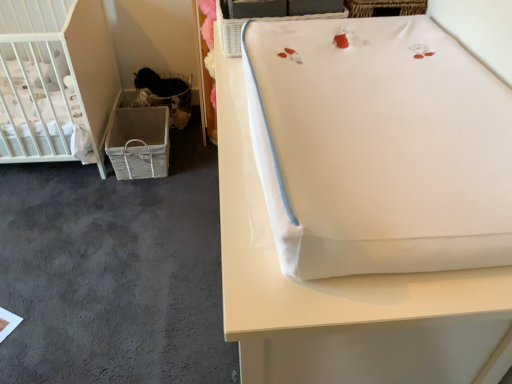
Measure the distance between woven fabric basket at lower left and camera.

woven fabric basket at lower left and camera are 7.19 feet apart from each other.

What do you see at coordinates (113, 275) in the screenshot? This screenshot has height=384, width=512. I see `gray carpet at lower left` at bounding box center [113, 275].

The height and width of the screenshot is (384, 512). What do you see at coordinates (343, 295) in the screenshot?
I see `white fabric changing pad at upper right` at bounding box center [343, 295].

Find the location of a particular element. The image size is (512, 384). white matte crib at left is located at coordinates (55, 80).

Consider the image. Is gray carpet at lower left wider or thinner than white wicker basket at upper center, arranged as the second basket when viewed from the left?

Considering their sizes, gray carpet at lower left looks broader than white wicker basket at upper center, arranged as the second basket when viewed from the left.

Based on their sizes in the image, would you say gray carpet at lower left is bigger or smaller than white wicker basket at upper center, the first basket positioned from the front?

Considering their sizes, gray carpet at lower left takes up more space than white wicker basket at upper center, the first basket positioned from the front.

Would you say gray carpet at lower left is to the left or to the right of white wicker basket at upper center, the first basket positioned from the front, in the picture?

gray carpet at lower left is positioned on white wicker basket at upper center, the first basket positioned from the front,'s left side.

Is gray carpet at lower left taller or shorter than white wicker basket at upper center, arranged as the second basket when viewed from the left?

In the image, gray carpet at lower left appears to be shorter than white wicker basket at upper center, arranged as the second basket when viewed from the left.

How far apart are white wicker basket at upper center, marked as the 2th basket in a back-to-front arrangement, and white fabric changing pad at upper right?

white wicker basket at upper center, marked as the 2th basket in a back-to-front arrangement, is 49.37 centimeters away from white fabric changing pad at upper right.

Which is closer, (339,14) or (227,318)?

Point (227,318)

The image size is (512, 384). What are the coordinates of `the 1st basket to the left of the white fabric changing pad at upper right, counting from the anchor's position` in the screenshot? It's located at (229, 33).

Are white wicker basket at upper center, marked as the 2th basket in a back-to-front arrangement, and white fabric changing pad at upper right located far from each other?

white wicker basket at upper center, marked as the 2th basket in a back-to-front arrangement, is near white fabric changing pad at upper right, not far away.

Which object is closer to the camera, white fabric changing pad at upper right or woven fabric basket at lower left, the 1th basket from the back?

Positioned in front is white fabric changing pad at upper right.

Based on the photo, does white fabric changing pad at upper right appear on the left side of woven fabric basket at lower left, arranged as the 1th basket when viewed from the left?

No.

Looking at this image, from the image's perspective, is white fabric changing pad at upper right above or below woven fabric basket at lower left, the 2th basket viewed from the right?

From the image's perspective, white fabric changing pad at upper right appears below woven fabric basket at lower left, the 2th basket viewed from the right.

I want to click on furniture lying in front of the woven fabric basket at lower left, the 2th basket in the front-to-back sequence, so click(x=343, y=295).

Which of these two, woven fabric basket at lower left, the 2th basket in the front-to-back sequence, or white wicker basket at upper center, arranged as the second basket when viewed from the left, is bigger?

woven fabric basket at lower left, the 2th basket in the front-to-back sequence.

Is woven fabric basket at lower left, arranged as the 1th basket when viewed from the left, positioned with its back to white wicker basket at upper center, the first basket positioned from the front?

No, white wicker basket at upper center, the first basket positioned from the front, is not at the back of woven fabric basket at lower left, arranged as the 1th basket when viewed from the left.

From the image's perspective, between woven fabric basket at lower left, arranged as the 1th basket when viewed from the left, and white wicker basket at upper center, arranged as the second basket when viewed from the left, who is located below?

white wicker basket at upper center, arranged as the second basket when viewed from the left, appears lower in the image.

Does point (183, 98) lie behind point (120, 115)?

Yes, point (183, 98) is behind point (120, 115).

From a real-world perspective, which basket is the 1st one above the woven fabric basket at lower left? Please provide its 2D coordinates.

[(164, 95)]

Which is more to the right, woven fabric basket at lower left, arranged as the 1th basket when viewed from the left, or woven fabric basket at lower left?

woven fabric basket at lower left, arranged as the 1th basket when viewed from the left, is more to the right.

Consider the image. Looking at their sizes, would you say woven fabric basket at lower left, the 2th basket in the front-to-back sequence, is wider or thinner than woven fabric basket at lower left?

Considering their sizes, woven fabric basket at lower left, the 2th basket in the front-to-back sequence, looks slimmer than woven fabric basket at lower left.

Is woven fabric basket at lower left oriented away from woven fabric basket at lower left, the 2th basket in the front-to-back sequence?

Yes, woven fabric basket at lower left's orientation is away from woven fabric basket at lower left, the 2th basket in the front-to-back sequence.

Which is less distant, (117, 142) or (179, 89)?

The point (117, 142) is closer.

There is a woven fabric basket at lower left. Identify the location of the 2nd basket above it (from the image's perspective). Image resolution: width=512 pixels, height=384 pixels. (164, 95).

Between woven fabric basket at lower left and woven fabric basket at lower left, the 2th basket in the front-to-back sequence, which one has less height?

woven fabric basket at lower left.

Consider the image. Who is shorter, woven fabric basket at lower left, the 2th basket viewed from the right, or white matte crib at left?

woven fabric basket at lower left, the 2th basket viewed from the right, is shorter.

In the scene shown: Is woven fabric basket at lower left, arranged as the 1th basket when viewed from the left, oriented towards white matte crib at left?

No, woven fabric basket at lower left, arranged as the 1th basket when viewed from the left, is not aimed at white matte crib at left.

Who is bigger, woven fabric basket at lower left, the 1th basket from the back, or white matte crib at left?

Bigger between the two is white matte crib at left.

Identify the location of concrete located behind the white wicker basket at upper center, the first basket positioned from the front. (113, 275).

At what (x,y) coordinates should I click in order to perform the action: click on furniture below the white wicker basket at upper center, the first basket viewed from the right (from the image's perspective). Please return your answer as a coordinate pair (x, y). Looking at the image, I should click on (343, 295).

Which object lies further to the anchor point woven fabric basket at lower left, the 2th basket in the front-to-back sequence, white wicker basket at upper center, the first basket viewed from the right, or white matte crib at left?

The object further to woven fabric basket at lower left, the 2th basket in the front-to-back sequence, is white wicker basket at upper center, the first basket viewed from the right.

Which object lies nearer to the anchor point gray carpet at lower left, woven fabric basket at lower left, arranged as the 1th basket when viewed from the left, or woven fabric basket at lower left?

The object closer to gray carpet at lower left is woven fabric basket at lower left.

Which object lies nearer to the anchor point white matte crib at left, white fabric changing pad at upper right or woven fabric basket at lower left, the 2th basket viewed from the right?

woven fabric basket at lower left, the 2th basket viewed from the right, is closer to white matte crib at left.

Estimate the real-world distances between objects in this image. Which object is further from white matte crib at left, gray carpet at lower left or white wicker basket at upper center, marked as the 2th basket in a back-to-front arrangement?

white wicker basket at upper center, marked as the 2th basket in a back-to-front arrangement.

Based on their spatial positions, is woven fabric basket at lower left or white matte crib at left further from white wicker basket at upper center, the first basket viewed from the right?

The object further to white wicker basket at upper center, the first basket viewed from the right, is woven fabric basket at lower left.

When comparing their distances from white fabric changing pad at upper right, does white wicker basket at upper center, arranged as the second basket when viewed from the left, or woven fabric basket at lower left, arranged as the 1th basket when viewed from the left, seem closer?

Based on the image, white wicker basket at upper center, arranged as the second basket when viewed from the left, appears to be nearer to white fabric changing pad at upper right.

Based on their spatial positions, is white matte crib at left or white fabric changing pad at upper right further from woven fabric basket at lower left, the 2th basket viewed from the right?

Based on the image, white fabric changing pad at upper right appears to be further to woven fabric basket at lower left, the 2th basket viewed from the right.

When comparing their distances from white wicker basket at upper center, the first basket positioned from the front, does woven fabric basket at lower left, the 2th basket viewed from the right, or white fabric changing pad at upper right seem further?

woven fabric basket at lower left, the 2th basket viewed from the right, is positioned further to the anchor white wicker basket at upper center, the first basket positioned from the front.

Where is `crate between gray carpet at lower left and woven fabric basket at lower left, arranged as the 1th basket when viewed from the left, along the z-axis`? The image size is (512, 384). crate between gray carpet at lower left and woven fabric basket at lower left, arranged as the 1th basket when viewed from the left, along the z-axis is located at coordinates (139, 142).

The width and height of the screenshot is (512, 384). Identify the location of crate situated between white matte crib at left and white wicker basket at upper center, the first basket positioned from the front, from left to right. (139, 142).

Locate an element on the screen. The height and width of the screenshot is (384, 512). infant bed located between gray carpet at lower left and woven fabric basket at lower left in the depth direction is located at coordinates (55, 80).

Locate an element on the screen. Image resolution: width=512 pixels, height=384 pixels. infant bed between gray carpet at lower left and woven fabric basket at lower left, the 1th basket from the back, along the z-axis is located at coordinates (55, 80).